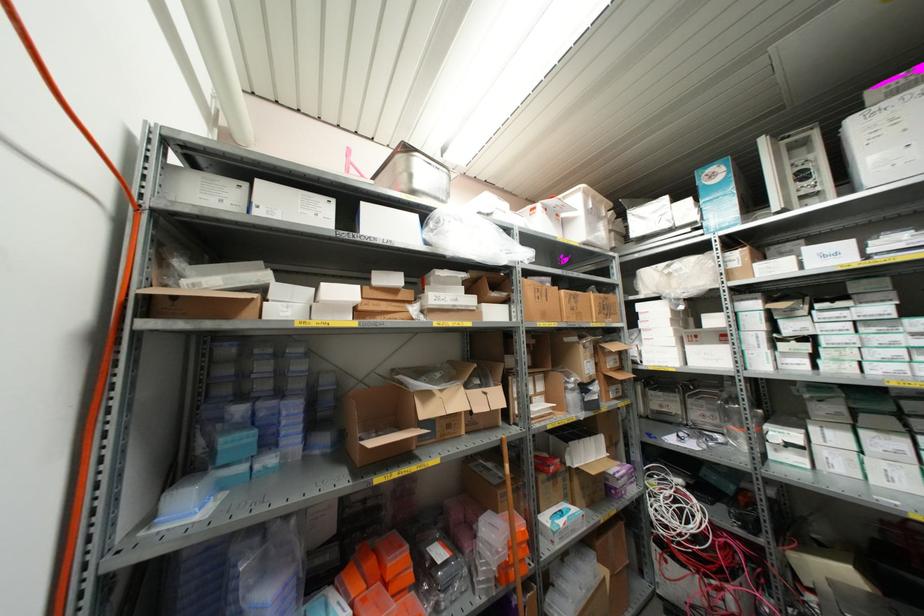
The location [186,496] corresponds to which object?

It corresponds to the blue pipette tip rack in the image.